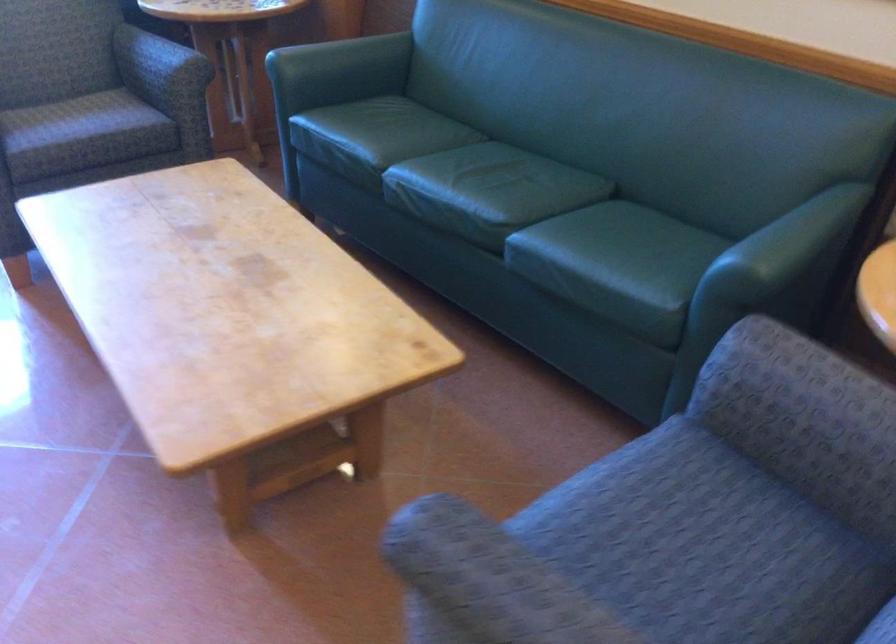
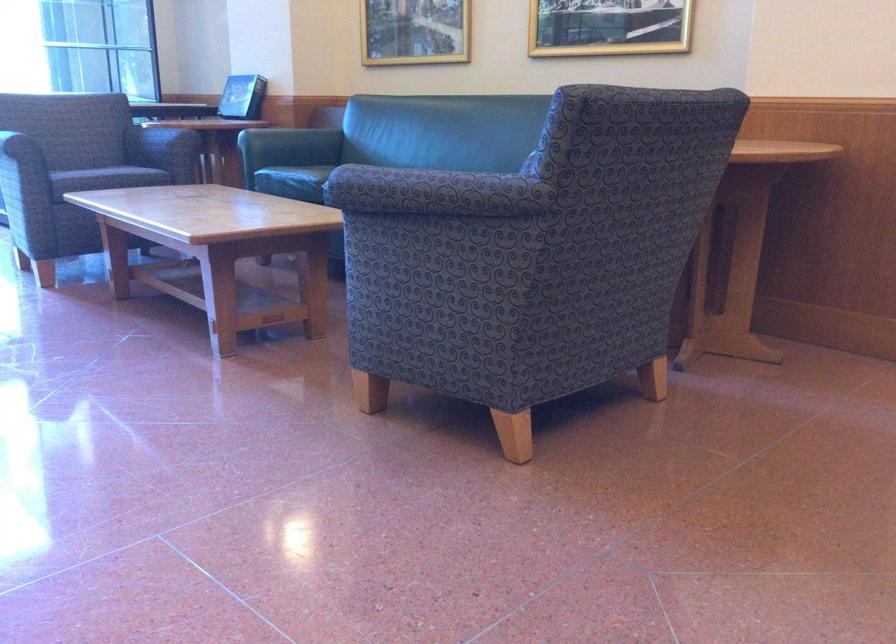
In the second image, find the point that corresponds to point (346, 154) in the first image.

(293, 182)